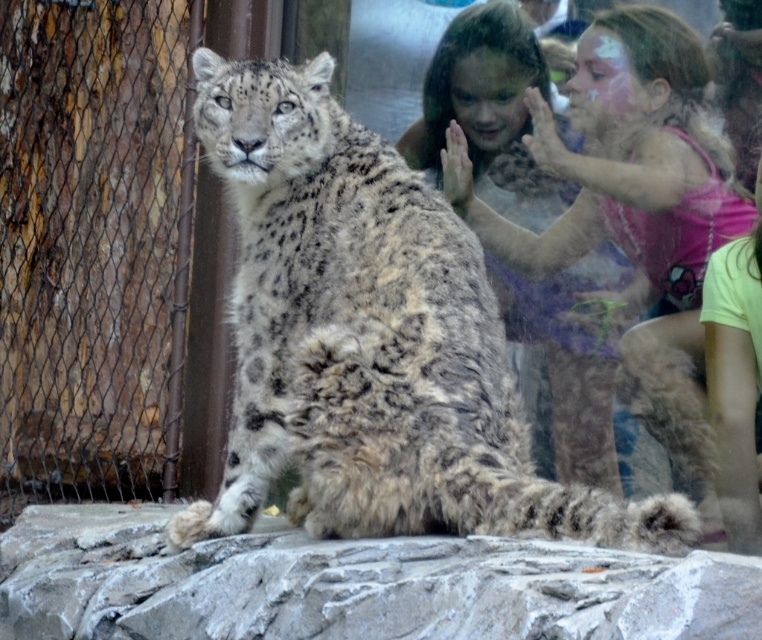
You are a zookeeper responsible for ensuring that all animals are visible to visitors. You notice that the spotted fur cheetah at center and the smooth skin child at upper right are positioned in a way that might block each other. Based on their sizes, which one should you adjust to ensure both are visible?

The spotted fur cheetah at center is larger in width than the smooth skin child at upper right. To ensure both are visible, you should adjust the position of the smooth skin child at upper right since it is smaller and easier to reposition without disturbing the larger animal.

Consider the image. You are a zookeeper who needs to place a new feeding tray for the snow leopard. The tray must be placed between the gray rough stone at center and the smooth skin child at upper right. Which object should the feeding tray be closer to?

The feeding tray should be placed closer to the gray rough stone at center because it is positioned on the left side of the smooth skin child at upper right, so placing it near the stone would keep it away from the visitors on the other side of the glass barrier.

You are a zookeeper planning to place a new feeding station in the enclosure. The feeding station must be placed exactly at point (x=370, y=340). What animal should you avoid placing the feeding station too close to?

The feeding station at point (x=370, y=340) should avoid being too close to the spotted fur cheetah at center, as the point indicates the location of the cheetah.